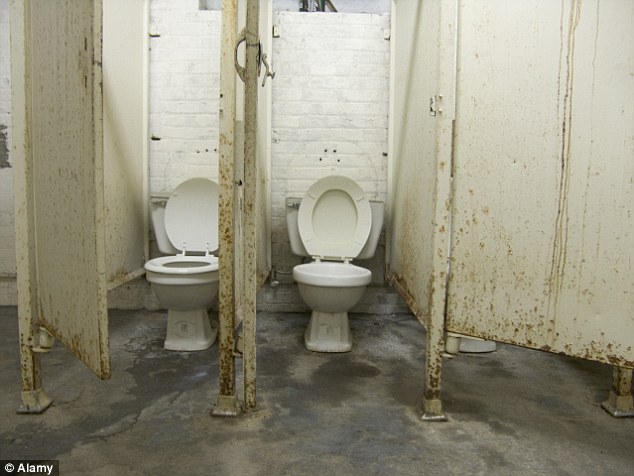
At what (x,y) coordinates should I click in order to perform the action: click on back of toilet. Please return your answer as a coordinate pair (x, y). The height and width of the screenshot is (476, 634). Looking at the image, I should click on (158, 225), (294, 241).